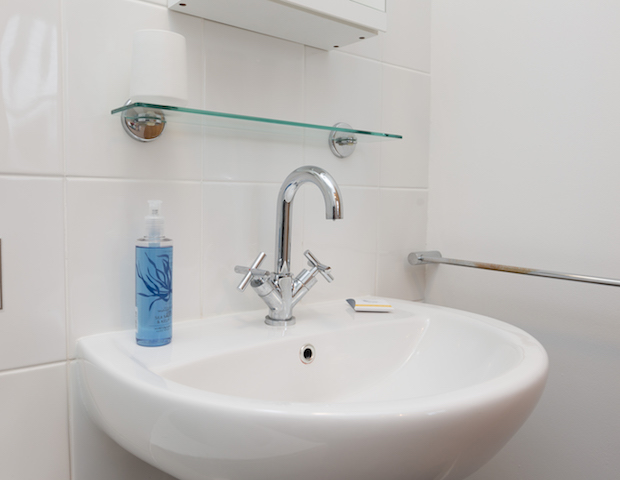
Find the location of a particular element. The image size is (620, 480). hole in sink basin is located at coordinates (308, 357).